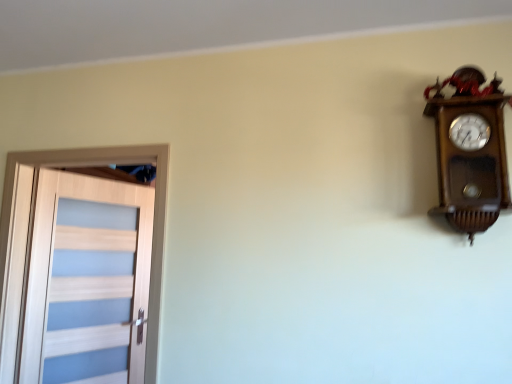
This screenshot has width=512, height=384. What do you see at coordinates (470, 150) in the screenshot? I see `wooden wall clock at upper right` at bounding box center [470, 150].

This screenshot has height=384, width=512. What are the coordinates of `wooden wall clock at upper right` in the screenshot? It's located at (470, 150).

Measure the distance between wooden wall clock at upper right and camera.

wooden wall clock at upper right and camera are 1.59 meters apart.

Image resolution: width=512 pixels, height=384 pixels. What do you see at coordinates (87, 281) in the screenshot?
I see `light wood door at left` at bounding box center [87, 281].

The height and width of the screenshot is (384, 512). Identify the location of light wood door at left. (87, 281).

Locate an element on the screen. This screenshot has width=512, height=384. wooden wall clock at upper right is located at coordinates (470, 150).

Considering the positions of objects wooden wall clock at upper right and light wood door at left in the image provided, who is more to the right, wooden wall clock at upper right or light wood door at left?

wooden wall clock at upper right.

Considering the positions of objects wooden wall clock at upper right and light wood door at left in the image provided, who is in front, wooden wall clock at upper right or light wood door at left?

wooden wall clock at upper right is closer to the camera.

Is point (448, 102) more distant than point (108, 326)?

No, it is not.

Looking at this image, from the image's perspective, is wooden wall clock at upper right located above light wood door at left?

Yes.

From a real-world perspective, is wooden wall clock at upper right above or below light wood door at left?

In terms of real-world spatial position, wooden wall clock at upper right is above light wood door at left.

Is wooden wall clock at upper right wider than light wood door at left?

No.

In terms of height, does wooden wall clock at upper right look taller or shorter compared to light wood door at left?

Considering their sizes, wooden wall clock at upper right has less height than light wood door at left.

Between wooden wall clock at upper right and light wood door at left, which one has smaller size?

wooden wall clock at upper right.

Consider the image. Is wooden wall clock at upper right spatially inside light wood door at left, or outside of it?

wooden wall clock at upper right is not inside light wood door at left, it's outside.

Based on the photo, is wooden wall clock at upper right placed right next to light wood door at left?

They are not placed beside each other.

Is wooden wall clock at upper right facing towards light wood door at left?

No, wooden wall clock at upper right is not oriented towards light wood door at left.

How far apart are wooden wall clock at upper right and light wood door at left?

A distance of 2.05 meters exists between wooden wall clock at upper right and light wood door at left.

Identify the location of wall clock located above the light wood door at left (from the image's perspective). (470, 150).

Which is more to the left, light wood door at left or wooden wall clock at upper right?

Positioned to the left is light wood door at left.

Is the depth of light wood door at left greater than that of wooden wall clock at upper right?

Yes, light wood door at left is further from the viewer.

Does point (138, 364) come in front of point (472, 126)?

No, it is not.

From the image's perspective, would you say light wood door at left is positioned over wooden wall clock at upper right?

Actually, light wood door at left appears below wooden wall clock at upper right in the image.

From a real-world perspective, which object stands above the other?

wooden wall clock at upper right is physically above.

Can you confirm if light wood door at left is thinner than wooden wall clock at upper right?

No.

Which of these two, light wood door at left or wooden wall clock at upper right, stands shorter?

wooden wall clock at upper right.

Considering the relative sizes of light wood door at left and wooden wall clock at upper right in the image provided, is light wood door at left smaller than wooden wall clock at upper right?

Incorrect, light wood door at left is not smaller in size than wooden wall clock at upper right.

Is wooden wall clock at upper right inside light wood door at left?

Actually, wooden wall clock at upper right is outside light wood door at left.

Based on the photo, is light wood door at left next to wooden wall clock at upper right and touching it?

light wood door at left and wooden wall clock at upper right are not in contact.

Is light wood door at left aimed at wooden wall clock at upper right?

Yes, light wood door at left is turned towards wooden wall clock at upper right.

This screenshot has height=384, width=512. Find the location of `door on the left of the wooden wall clock at upper right`. door on the left of the wooden wall clock at upper right is located at coordinates (87, 281).

Find the location of `wall clock above the light wood door at left (from a real-world perspective)`. wall clock above the light wood door at left (from a real-world perspective) is located at coordinates pos(470,150).

I want to click on wall clock that is on the right side of light wood door at left, so click(470, 150).